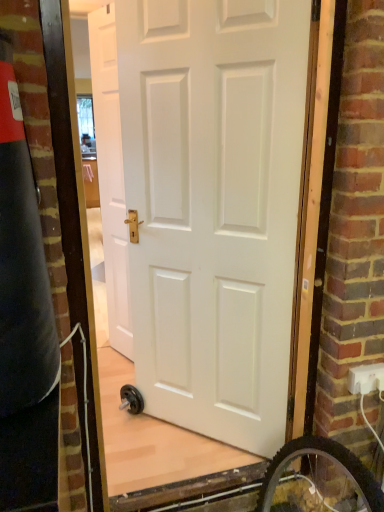
Question: Should I look upward or downward to see white matte door at center, which is the first door in left-to-right order?

Choices:
 (A) down
 (B) up

Answer: (B)

Question: Can you see white matte door at center, the 2th door from the back, touching white matte door at center, which is the first door in left-to-right order?

Choices:
 (A) yes
 (B) no

Answer: (B)

Question: Is white matte door at center, arranged as the 1th door when viewed from the right, positioned beyond the bounds of white matte door at center, arranged as the 2th door when viewed from the front?

Choices:
 (A) yes
 (B) no

Answer: (A)

Question: Are white matte door at center, which is the 1th door in front-to-back order, and white matte door at center, arranged as the 2th door when viewed from the front, located far from each other?

Choices:
 (A) yes
 (B) no

Answer: (B)

Question: Is white matte door at center, arranged as the 2th door when viewed from the front, at the back of white matte door at center, positioned as the 2th door in left-to-right order?

Choices:
 (A) no
 (B) yes

Answer: (A)

Question: Is white matte door at center, the 2th door from the back, closer to camera compared to white matte door at center, which is the first door in left-to-right order?

Choices:
 (A) no
 (B) yes

Answer: (B)

Question: From a real-world perspective, does white matte door at center, the 2th door from the back, sit lower than white matte door at center, arranged as the 2th door when viewed from the front?

Choices:
 (A) yes
 (B) no

Answer: (A)

Question: Considering the relative positions of white matte door at center, which is the 1th door in back-to-front order, and white plastic electric outlet at lower right in the image provided, is white matte door at center, which is the 1th door in back-to-front order, to the right of white plastic electric outlet at lower right from the viewer's perspective?

Choices:
 (A) yes
 (B) no

Answer: (B)

Question: Considering the relative sizes of white matte door at center, which is the first door in left-to-right order, and white plastic electric outlet at lower right in the image provided, is white matte door at center, which is the first door in left-to-right order, bigger than white plastic electric outlet at lower right?

Choices:
 (A) no
 (B) yes

Answer: (B)

Question: From a real-world perspective, is white matte door at center, which is the first door in left-to-right order, physically above white plastic electric outlet at lower right?

Choices:
 (A) no
 (B) yes

Answer: (B)

Question: Is white matte door at center, which is the first door in left-to-right order, to the left of white plastic electric outlet at lower right from the viewer's perspective?

Choices:
 (A) no
 (B) yes

Answer: (B)

Question: Is white plastic electric outlet at lower right a part of white matte door at center, which is the second door from right to left?

Choices:
 (A) no
 (B) yes

Answer: (A)

Question: From the image's perspective, is white matte door at center, arranged as the 2th door when viewed from the front, on top of white plastic electric outlet at lower right?

Choices:
 (A) yes
 (B) no

Answer: (A)

Question: From a real-world perspective, is white plastic electric outlet at lower right located beneath white matte door at center, which is the 1th door in front-to-back order?

Choices:
 (A) yes
 (B) no

Answer: (A)